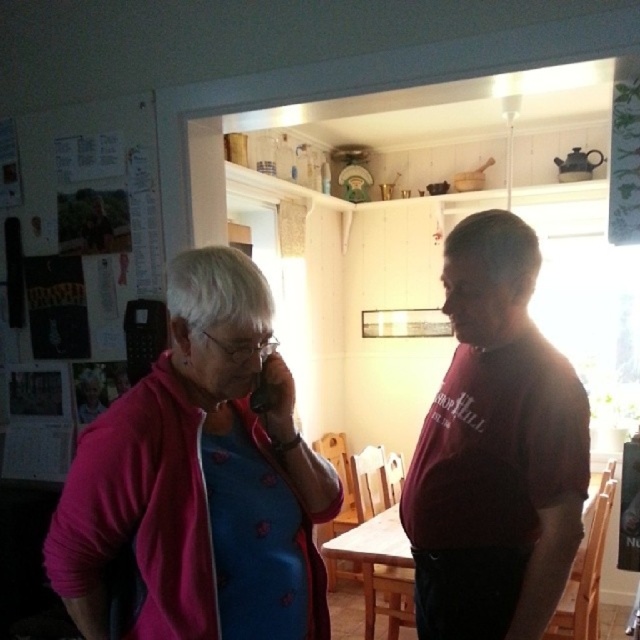
How far apart are pink fabric at left and maroon cotton shirt at center?

pink fabric at left and maroon cotton shirt at center are 19.52 inches apart from each other.

Is pink fabric at left shorter than maroon cotton shirt at center?

Correct, pink fabric at left is not as tall as maroon cotton shirt at center.

Where is `pink fabric at left`? This screenshot has height=640, width=640. pink fabric at left is located at coordinates (200, 477).

Who is more distant from viewer, (492, 371) or (467, 600)?

The point (467, 600) is more distant.

Describe the element at coordinates (496, 451) in the screenshot. I see `pink fabric jacket at center` at that location.

Locate an element on the screen. The height and width of the screenshot is (640, 640). pink fabric jacket at center is located at coordinates (496, 451).

You are a GUI agent. You are given a task and a screenshot of the screen. Output one action in this format:
    pyautogui.click(x=<x>, y=<y>)
    Task: Click on the pink fabric jacket at center
    This screenshot has height=640, width=640.
    Given the screenshot: What is the action you would take?
    pyautogui.click(x=496, y=451)

Between pink fabric at left and pink fabric jacket at center, which one appears on the right side from the viewer's perspective?

pink fabric jacket at center is more to the right.

Does pink fabric at left have a larger size compared to pink fabric jacket at center?

Incorrect, pink fabric at left is not larger than pink fabric jacket at center.

Find the location of a particular element. The width and height of the screenshot is (640, 640). pink fabric at left is located at coordinates (200, 477).